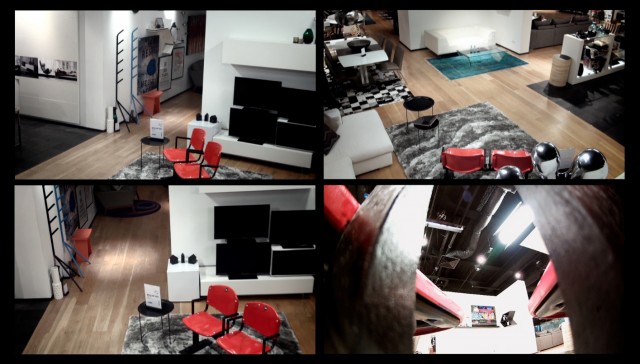
At what (x,y) coordinates should I click in order to perform the action: click on industrial hvac vent. Please return your answer as a coordinate pair (x, y). The height and width of the screenshot is (364, 640). Looking at the image, I should click on (468, 247).